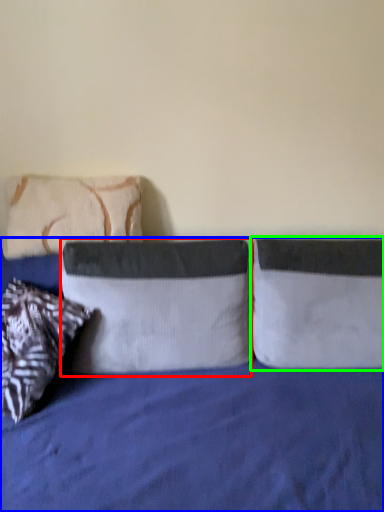
Question: Estimate the real-world distances between objects in this image. Which object is closer to pillow (highlighted by a red box), bed (highlighted by a blue box) or pillow (highlighted by a green box)?

Choices:
 (A) bed
 (B) pillow

Answer: (A)